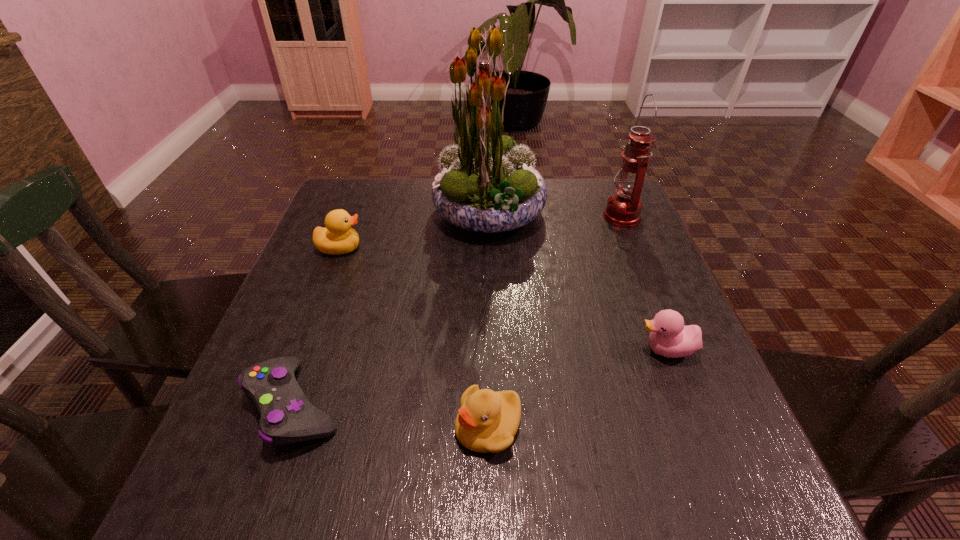
This screenshot has height=540, width=960. What are the coordinates of `blank space at the far left corner of the desktop` in the screenshot? It's located at (367, 181).

The width and height of the screenshot is (960, 540). In the image, there is a desktop. What are the coordinates of `blank space at the far right corner` in the screenshot? It's located at (592, 181).

Where is `vacant space that is in between the farthest duckling and the shortest object`? The width and height of the screenshot is (960, 540). vacant space that is in between the farthest duckling and the shortest object is located at coordinates (317, 326).

At what (x,y) coordinates should I click in order to perform the action: click on unoccupied position between the rightmost duckling and the fifth shortest object. Please return your answer as a coordinate pair (x, y). This screenshot has height=540, width=960. Looking at the image, I should click on (644, 283).

At what (x,y) coordinates should I click in order to perform the action: click on empty location between the second nearest duckling and the nearest duckling. Please return your answer as a coordinate pair (x, y). Looking at the image, I should click on (577, 388).

This screenshot has height=540, width=960. I want to click on empty space that is in between the rightmost duckling and the second duckling from left to right, so click(x=577, y=388).

The image size is (960, 540). What are the coordinates of `free space between the flower arrangement and the rightmost duckling` in the screenshot? It's located at (578, 282).

The height and width of the screenshot is (540, 960). I want to click on unoccupied area between the second farthest duckling and the tallest object, so click(x=578, y=282).

I want to click on free space between the second farthest duckling and the tallest object, so click(578, 282).

What are the coordinates of `vacant space that's between the flower arrangement and the second farthest duckling` in the screenshot? It's located at (578, 282).